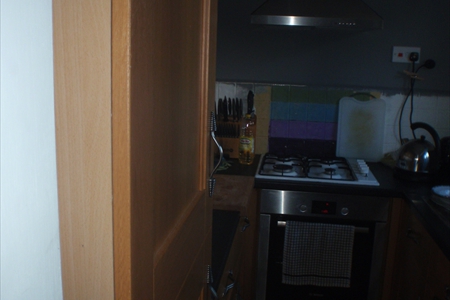
The image size is (450, 300). Find the location of `stainless steel oven`. stainless steel oven is located at coordinates (280, 201), (261, 251).